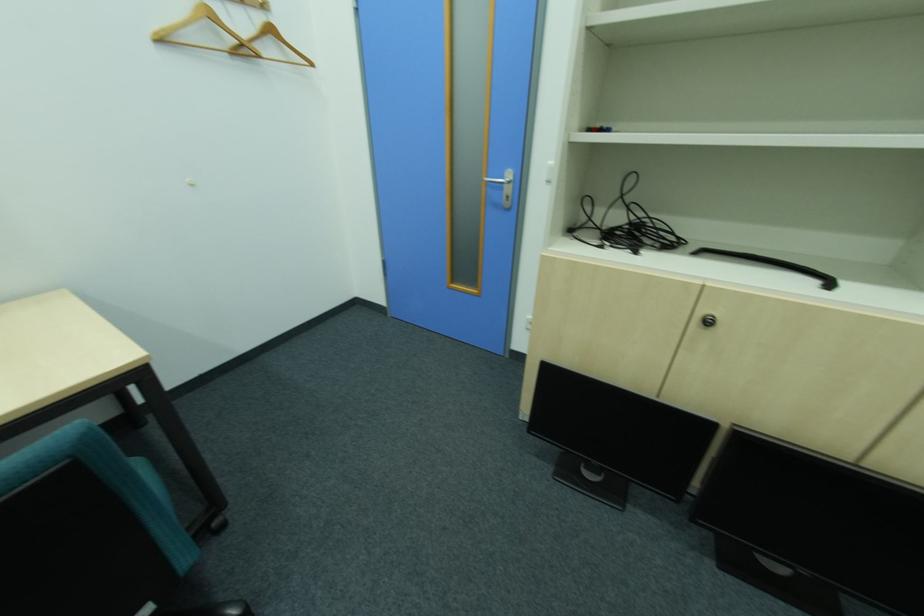
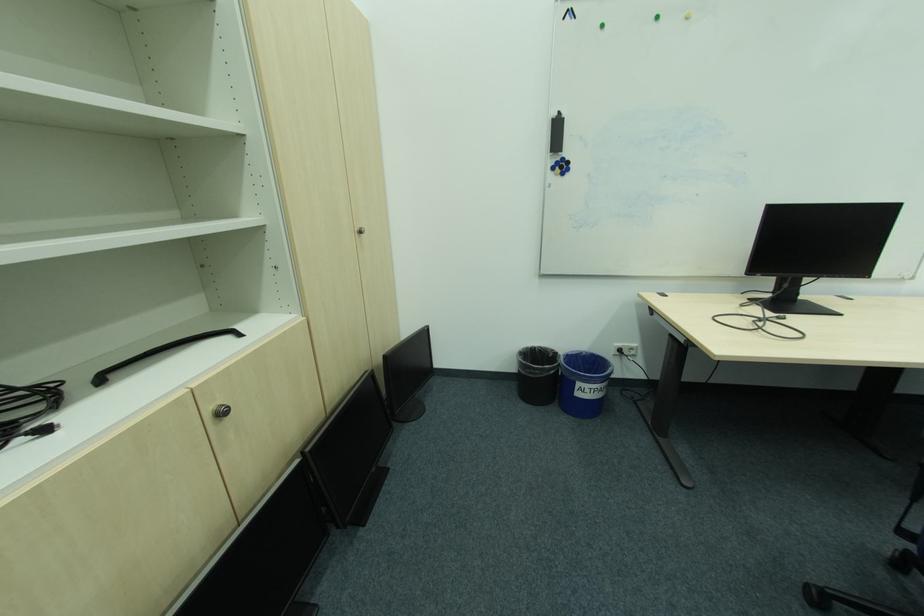
Find the pixel in the second image that matches pixel 716 323 in the first image.

(227, 415)